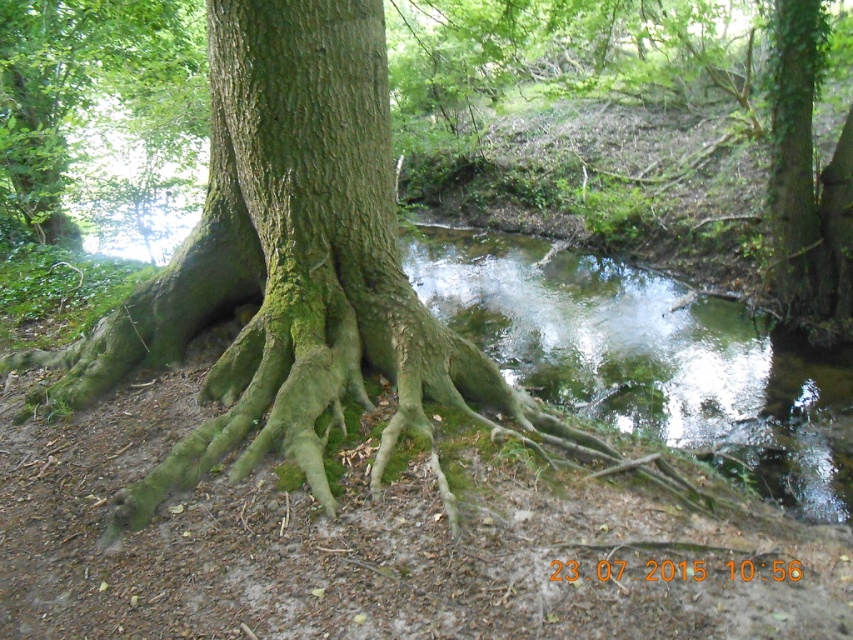
Can you confirm if green mossy water at center is smaller than green mossy roots at center?

Yes.

How far apart are green mossy water at center and green mossy roots at center?

8.59 meters

Image resolution: width=853 pixels, height=640 pixels. I want to click on green mossy water at center, so click(646, 358).